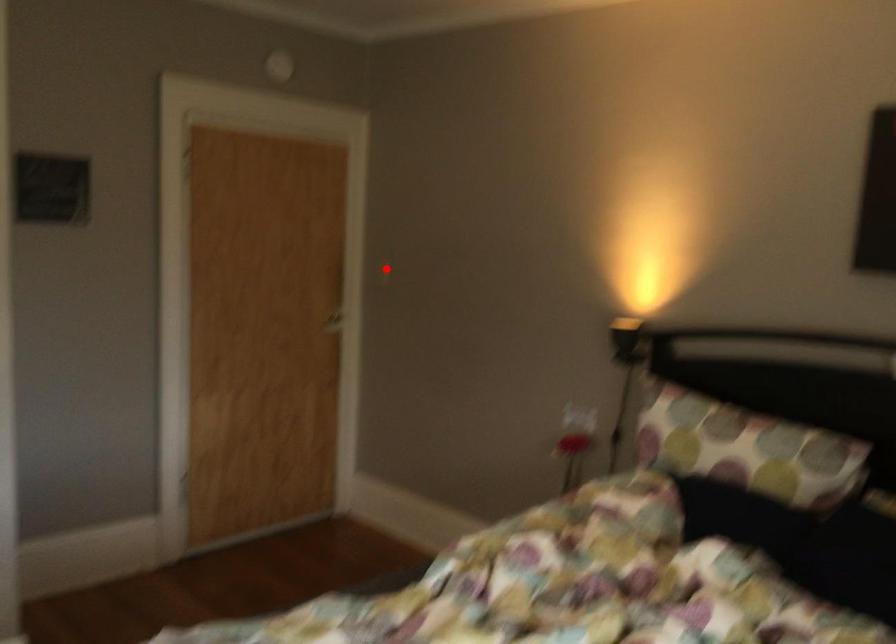
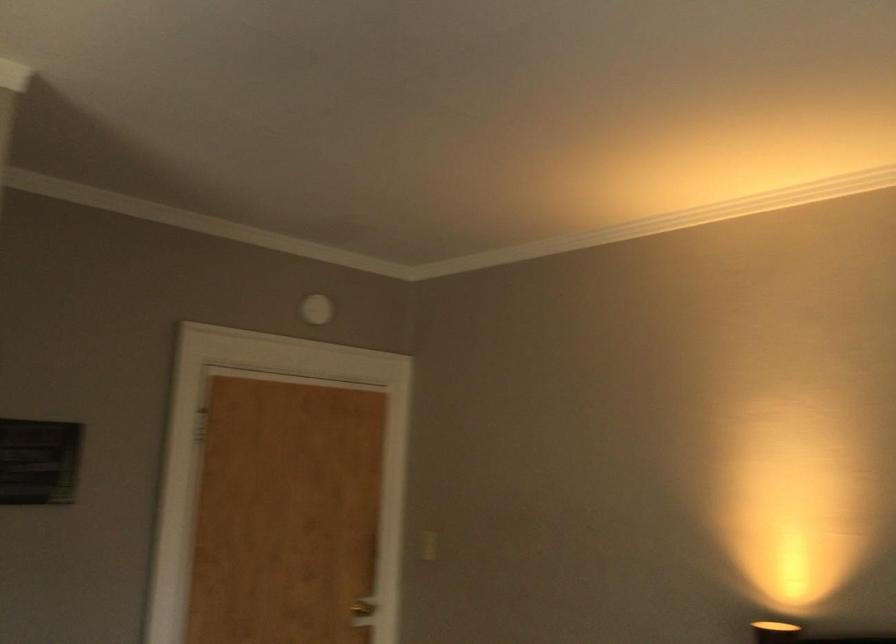
Question: I am providing you with two images of the same scene from different viewpoints. Given a red point in image1, look at the same physical point in image2. Is it:

Choices:
 (A) Closer to the viewpoint
 (B) Farther from the viewpoint

Answer: (A)